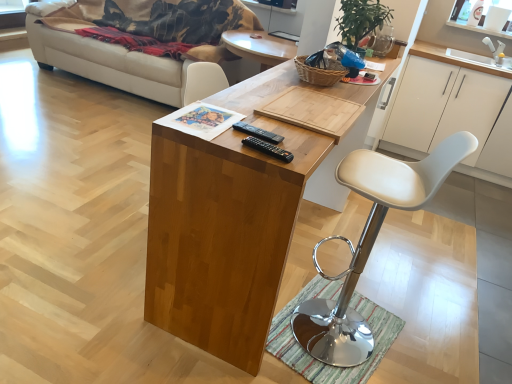
Where is `free space that is to the left of black plastic remote at center, placed as the first remote when sorted from back to front`? The height and width of the screenshot is (384, 512). free space that is to the left of black plastic remote at center, placed as the first remote when sorted from back to front is located at coordinates 203,126.